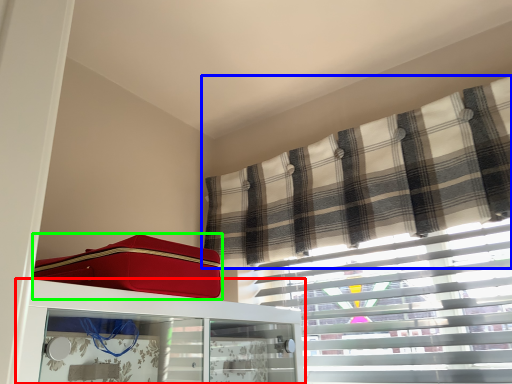
Question: Considering the real-world distances, which object is closest to furniture (highlighted by a red box)? curtain (highlighted by a blue box) or suitcase (highlighted by a green box).

Choices:
 (A) curtain
 (B) suitcase

Answer: (B)